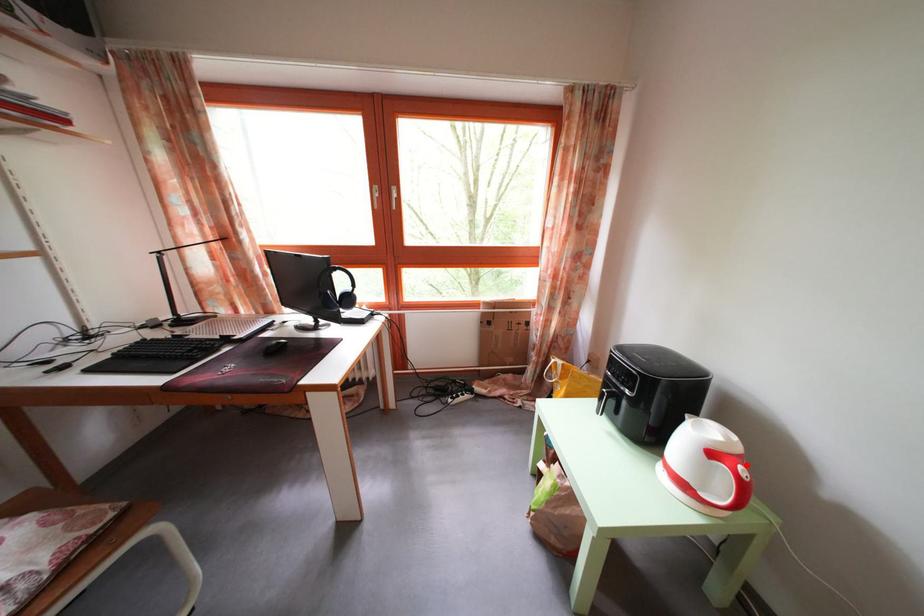
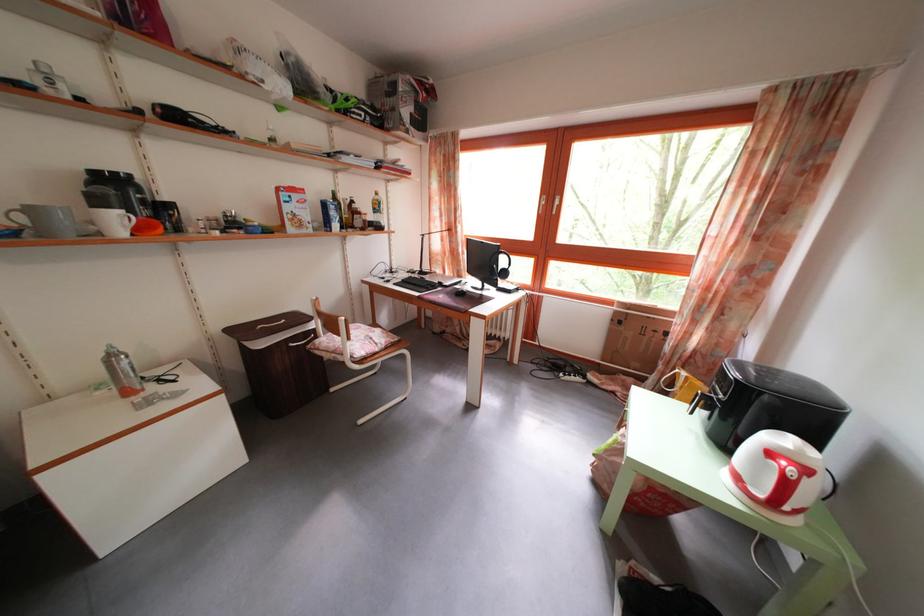
Question: I am providing you with two images of the same scene from different viewpoints. In image1, a red point is highlighted. Considering the same 3D point in image2, which of the following is correct?

Choices:
 (A) It is closer
 (B) It is farther

Answer: (A)